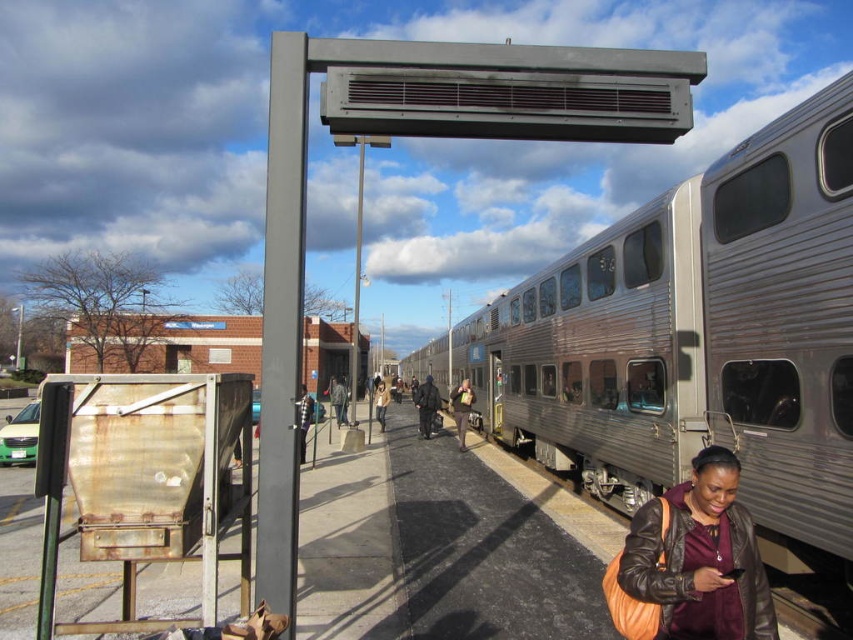
You are standing at the train station and want to board the silver metallic train at center. Based on its position, which direction should you walk to reach it?

The silver metallic train at center is located at point (695, 339), so you should walk towards the center of the platform to reach it.

You are standing at the train station and want to move from point A to point B. Point A is at coordinate point [643,456] and point B is at coordinate point [728,593]. Which point is closer to you?

Point A at coordinate point [643,456] is closer to you because it is further to the viewer than point B at coordinate point [728,593].

You are standing at the train station and want to take a photo of the silver metallic train at center and the leather jacket at lower right. Which object should you zoom in more on to capture both in the frame without cropping?

You should zoom in more on the leather jacket at lower right because the silver metallic train at center is larger in size than the leather jacket at lower right, so adjusting focus to the smaller object allows both to fit in the frame.